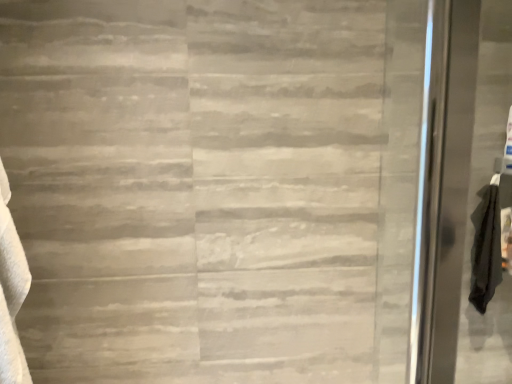
Locate an element on the screen. black cotton towel at right is located at coordinates (486, 246).

What is the approximate width of black cotton towel at right?

4.53 inches.

This screenshot has width=512, height=384. What do you see at coordinates (486, 246) in the screenshot?
I see `black cotton towel at right` at bounding box center [486, 246].

Find the location of a particular element. The image size is (512, 384). black cotton towel at right is located at coordinates (486, 246).